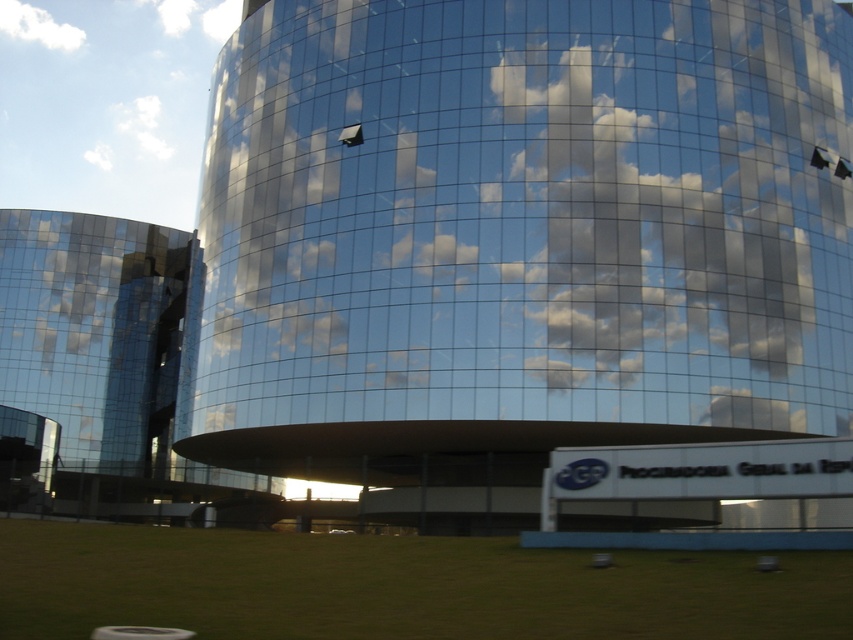
Question: Is transparent glass cloud at center to the right of white fluffy cloud at upper left from the viewer's perspective?

Choices:
 (A) no
 (B) yes

Answer: (B)

Question: Among these objects, which one is farthest from the camera?

Choices:
 (A) transparent glass cloud at center
 (B) white fluffy cloud at upper left

Answer: (B)

Question: Which point is farther to the camera?

Choices:
 (A) white fluffy cloud at upper left
 (B) transparent glass cloud at center

Answer: (A)

Question: Is transparent glass cloud at center behind white fluffy cloud at upper left?

Choices:
 (A) yes
 (B) no

Answer: (B)

Question: Can you confirm if transparent glass cloud at center is positioned above white fluffy cloud at upper left?

Choices:
 (A) no
 (B) yes

Answer: (A)